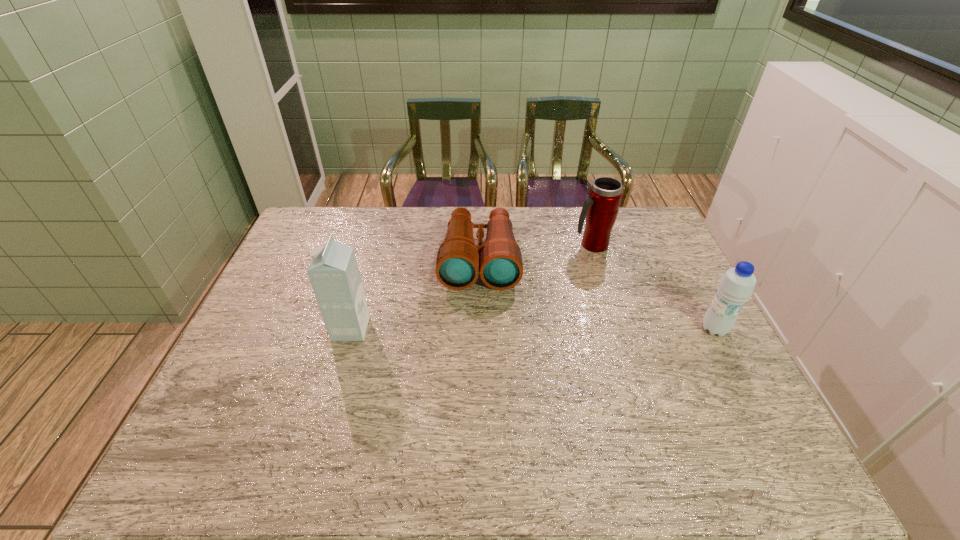
What are the coordinates of `vacant space on the desktop that is between the tallest object and the rightmost object and is positioned through the lenses of the shortest object` in the screenshot? It's located at (478, 329).

You are a GUI agent. You are given a task and a screenshot of the screen. Output one action in this format:
    pyautogui.click(x=<x>, y=<y>)
    Task: Click on the vacant spot on the desktop that is between the tallest object and the rightmost object and is positioned on the side with the handle of the thermos bottle
    The width and height of the screenshot is (960, 540).
    Given the screenshot: What is the action you would take?
    pyautogui.click(x=551, y=329)